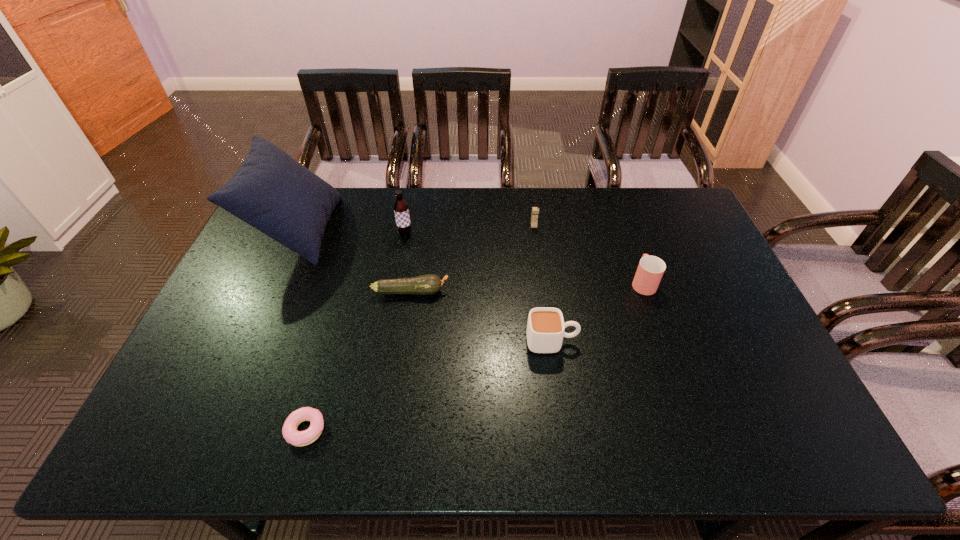
This screenshot has height=540, width=960. I want to click on cushion positioned at the far edge, so click(x=271, y=191).

What are the coordinates of `cellular telephone that is at the far edge` in the screenshot? It's located at (535, 210).

You are a GUI agent. You are given a task and a screenshot of the screen. Output one action in this format:
    pyautogui.click(x=<x>, y=<y>)
    Task: Click on the object located at the near edge
    Image resolution: width=960 pixels, height=540 pixels.
    Given the screenshot: What is the action you would take?
    pyautogui.click(x=289, y=430)

Identify the location of object present at the left edge. The height and width of the screenshot is (540, 960). (271, 191).

You are a GUI agent. You are given a task and a screenshot of the screen. Output one action in this format:
    pyautogui.click(x=<x>, y=<y>)
    Task: Click on the object located at the far left corner
    
    Given the screenshot: What is the action you would take?
    pyautogui.click(x=271, y=191)

In the image, there is a desktop. Where is `vacant space at the far edge`? The height and width of the screenshot is (540, 960). vacant space at the far edge is located at coordinates (480, 190).

In order to click on vacant space at the near edge in this screenshot , I will do `click(659, 430)`.

I want to click on free space at the left edge of the desktop, so click(x=195, y=370).

I want to click on vacant space at the right edge of the desktop, so click(737, 304).

I want to click on vacant region at the far right corner, so click(x=659, y=187).